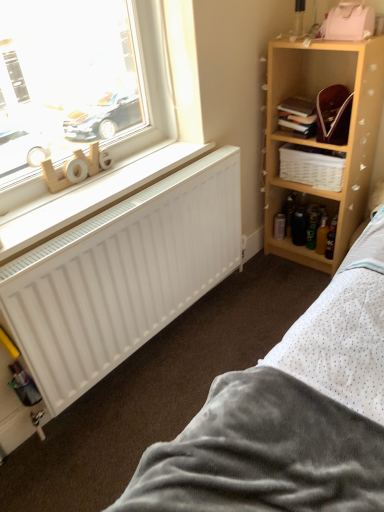
At what (x,y) coordinates should I click in order to perform the action: click on white matte radiator at lower left. Please return your answer as a coordinate pair (x, y). This screenshot has height=512, width=384. Looking at the image, I should click on (122, 276).

What is the approximate height of white matte radiator at lower left?

The height of white matte radiator at lower left is 12.71 centimeters.

What do you see at coordinates (324, 144) in the screenshot?
I see `wooden shelf at upper right` at bounding box center [324, 144].

Identify the location of wooden shelf at upper right. (324, 144).

What are the coordinates of `white woven basket at upper right` in the screenshot? It's located at (312, 166).

What is the approximate width of gray soft fabric bed at lower right?

The width of gray soft fabric bed at lower right is 1.02 meters.

What do you see at coordinates (289, 414) in the screenshot? I see `gray soft fabric bed at lower right` at bounding box center [289, 414].

Describe the element at coordinates (298, 115) in the screenshot. I see `hardcover book at upper right` at that location.

The width and height of the screenshot is (384, 512). Find the location of `white matte radiator at lower left`. white matte radiator at lower left is located at coordinates (122, 276).

Based on the photo, is wooden letters at lower left aimed at white woven basket at upper right?

No, wooden letters at lower left is not aimed at white woven basket at upper right.

In terms of height, does wooden letters at lower left look taller or shorter compared to white woven basket at upper right?

Clearly, wooden letters at lower left is shorter compared to white woven basket at upper right.

Is wooden letters at lower left next to white woven basket at upper right?

No, wooden letters at lower left is not next to white woven basket at upper right.

Based on their sizes in the image, would you say wooden letters at lower left is bigger or smaller than white woven basket at upper right?

Considering their sizes, wooden letters at lower left takes up less space than white woven basket at upper right.

Locate an element on the screen. The image size is (384, 512). cabinet above the wooden letters at window (from the image's perspective) is located at coordinates 312,166.

Who is taller, white woven basket at upper right or wooden letters at window?

white woven basket at upper right is taller.

From the image's perspective, which one is positioned higher, gray soft fabric bed at lower right or white woven basket at upper right?

From the image's view, white woven basket at upper right is above.

Which object is more forward, gray soft fabric bed at lower right or white woven basket at upper right?

Positioned in front is gray soft fabric bed at lower right.

Is gray soft fabric bed at lower right at the right side of white woven basket at upper right?

No, gray soft fabric bed at lower right is not to the right of white woven basket at upper right.

From a real-world perspective, who is located lower, hardcover book at upper right or wooden letters at window?

hardcover book at upper right.

Is hardcover book at upper right aimed at wooden letters at window?

Yes, hardcover book at upper right faces towards wooden letters at window.

Considering the sizes of hardcover book at upper right and wooden letters at window in the image, is hardcover book at upper right wider or thinner than wooden letters at window?

In the image, hardcover book at upper right appears to be wider than wooden letters at window.

Can you confirm if hardcover book at upper right is positioned to the left of wooden letters at window?

In fact, hardcover book at upper right is to the right of wooden letters at window.

Considering the sizes of wooden letters at window and wooden shelf at upper right in the image, is wooden letters at window wider or thinner than wooden shelf at upper right?

Clearly, wooden letters at window has less width compared to wooden shelf at upper right.

What are the coordinates of `toy in front of the wooden shelf at upper right` in the screenshot? It's located at (55, 177).

Is wooden letters at window not close to wooden shelf at upper right?

Yes, wooden letters at window and wooden shelf at upper right are quite far apart.

Considering the relative sizes of wooden letters at window and wooden shelf at upper right in the image provided, is wooden letters at window taller than wooden shelf at upper right?

No, wooden letters at window is not taller than wooden shelf at upper right.

Is hardcover book at upper right at the right side of wooden shelf at upper right?

In fact, hardcover book at upper right is to the left of wooden shelf at upper right.

Considering the sizes of hardcover book at upper right and wooden shelf at upper right in the image, is hardcover book at upper right taller or shorter than wooden shelf at upper right?

hardcover book at upper right is shorter than wooden shelf at upper right.

Looking at this image, from the image's perspective, is hardcover book at upper right located above wooden shelf at upper right?

Indeed, from the image's perspective, hardcover book at upper right is shown above wooden shelf at upper right.

Is hardcover book at upper right facing away from wooden shelf at upper right?

Yes, hardcover book at upper right's orientation is away from wooden shelf at upper right.

From the image's perspective, would you say white woven basket at upper right is positioned over hardcover book at upper right?

Actually, white woven basket at upper right appears below hardcover book at upper right in the image.

Between white woven basket at upper right and hardcover book at upper right, which one has larger size?

With larger size is white woven basket at upper right.

From the picture: Is white woven basket at upper right next to hardcover book at upper right?

No, white woven basket at upper right is not next to hardcover book at upper right.

Is white woven basket at upper right thinner than hardcover book at upper right?

Yes, white woven basket at upper right is thinner than hardcover book at upper right.

This screenshot has width=384, height=512. What are the coordinates of `cabinet above the wooden letters at lower left (from the image's perspective)` in the screenshot? It's located at (312, 166).

I want to click on cabinet below the wooden letters at window (from a real-world perspective), so click(x=312, y=166).

From the image, which object appears to be nearer to white matte radiator at lower left, wooden letters at window or wooden shelf at upper right?

Among the two, wooden letters at window is located nearer to white matte radiator at lower left.

In the scene shown: Based on their spatial positions, is wooden letters at window or hardcover book at upper right closer to wooden shelf at upper right?

Among the two, hardcover book at upper right is located nearer to wooden shelf at upper right.

Considering their positions, is white woven basket at upper right positioned closer to wooden letters at window than white matte radiator at lower left?

white matte radiator at lower left.

Looking at this image, looking at the image, which one is located further to wooden letters at lower left, wooden shelf at upper right or gray soft fabric bed at lower right?

Based on the image, gray soft fabric bed at lower right appears to be further to wooden letters at lower left.

Which object lies nearer to the anchor point white woven basket at upper right, white matte radiator at lower left or wooden letters at window?

white matte radiator at lower left is closer to white woven basket at upper right.

Estimate the real-world distances between objects in this image. Which object is closer to hardcover book at upper right, wooden letters at lower left or white woven basket at upper right?

white woven basket at upper right is positioned closer to the anchor hardcover book at upper right.

In the scene shown: When comparing their distances from gray soft fabric bed at lower right, does hardcover book at upper right or wooden shelf at upper right seem further?

hardcover book at upper right lies further to gray soft fabric bed at lower right than the other object.

Estimate the real-world distances between objects in this image. Which object is closer to wooden letters at lower left, wooden letters at window or hardcover book at upper right?

wooden letters at window is closer to wooden letters at lower left.

Identify the location of window sill between wooden letters at window and wooden shelf at upper right. This screenshot has width=384, height=512. (95, 197).

The image size is (384, 512). I want to click on shelf that lies between hardcover book at upper right and white matte radiator at lower left from top to bottom, so click(324, 144).

In order to click on book between wooden letters at window and wooden shelf at upper right in this screenshot , I will do `click(298, 115)`.

Image resolution: width=384 pixels, height=512 pixels. Identify the location of book positioned between wooden shelf at upper right and white woven basket at upper right from near to far. (298, 115).